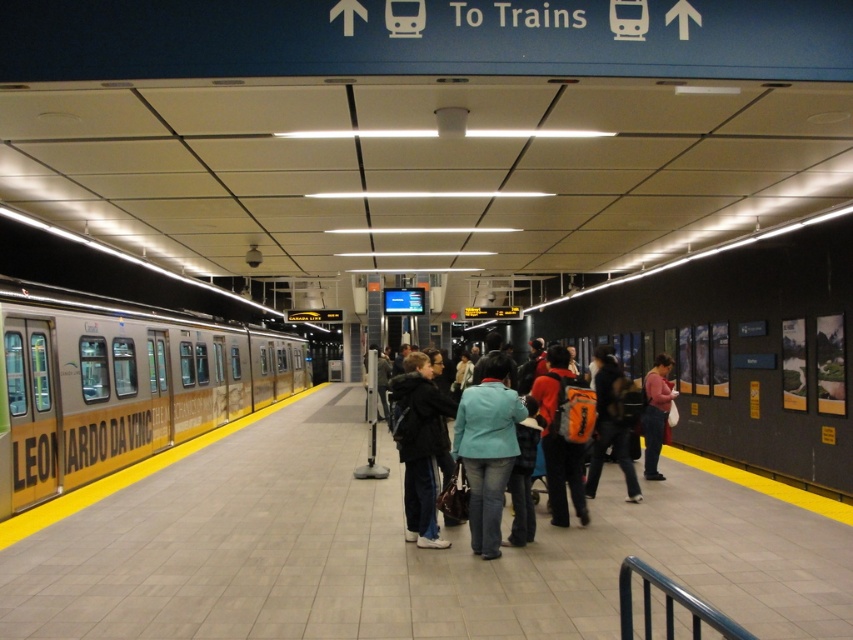
You are a subway platform attendant. You see a yellow metallic train at left and a denim jacket at center. Which object is wider?

The yellow metallic train at left is wider than the denim jacket at center.

You are standing on the subway platform and see a denim jacket at center. According to the coordinates provided, where is the denim jacket located relative to the yellow tactile strip?

The denim jacket at center is located at point (460, 445), which is away from the yellow tactile strip since the strip is along the edge of the platform.